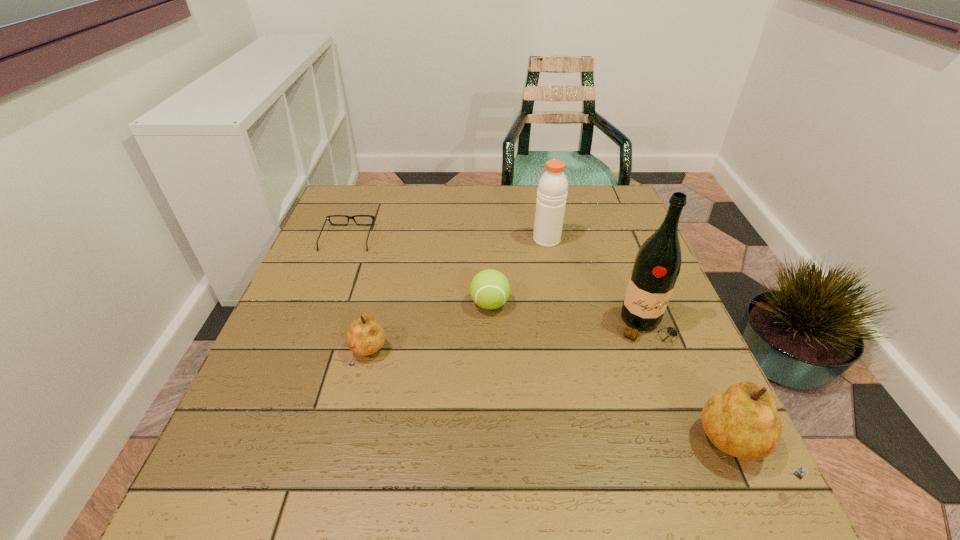
Please mark a free spot for a new pear to balance the arrangement. Please provide its 2D coordinates. Your answer should be formatted as a tuple, i.e. [(x, y)], where the tuple contains the x and y coordinates of a point satisfying the conditions above.

[(534, 399)]